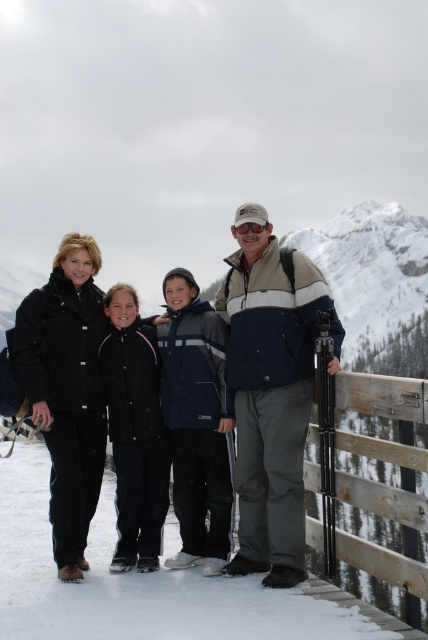
Is point (262, 419) closer to viewer compared to point (205, 486)?

Yes.

Is dark blue jacket at center in front of navy blue jacket at center?

That is True.

Is point (335, 353) positioned behind point (171, 564)?

No, it is in front of (171, 564).

Locate an element on the screen. dark blue jacket at center is located at coordinates (272, 390).

Can you confirm if dark blue jacket at center is positioned to the left of black matte jacket at center?

In fact, dark blue jacket at center is to the right of black matte jacket at center.

Which of these two, dark blue jacket at center or black matte jacket at center, stands taller?

Standing taller between the two is dark blue jacket at center.

Is point (279, 307) behind point (137, 340)?

No, it is in front of (137, 340).

This screenshot has width=428, height=640. Find the location of `dark blue jacket at center`. dark blue jacket at center is located at coordinates (272, 390).

Is point (259, 525) more distant than point (166, 300)?

No, it is not.

Is point (234, 412) behind point (172, 410)?

That is False.

This screenshot has height=640, width=428. In order to click on matte blue jacket at center in this screenshot , I will do `click(272, 390)`.